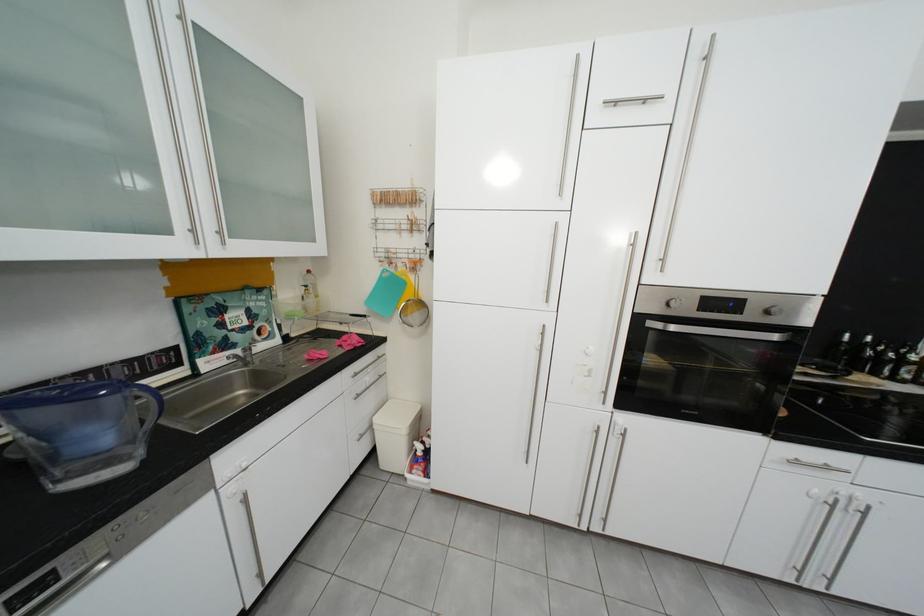
Where is `faucet handle`? faucet handle is located at coordinates (245, 355).